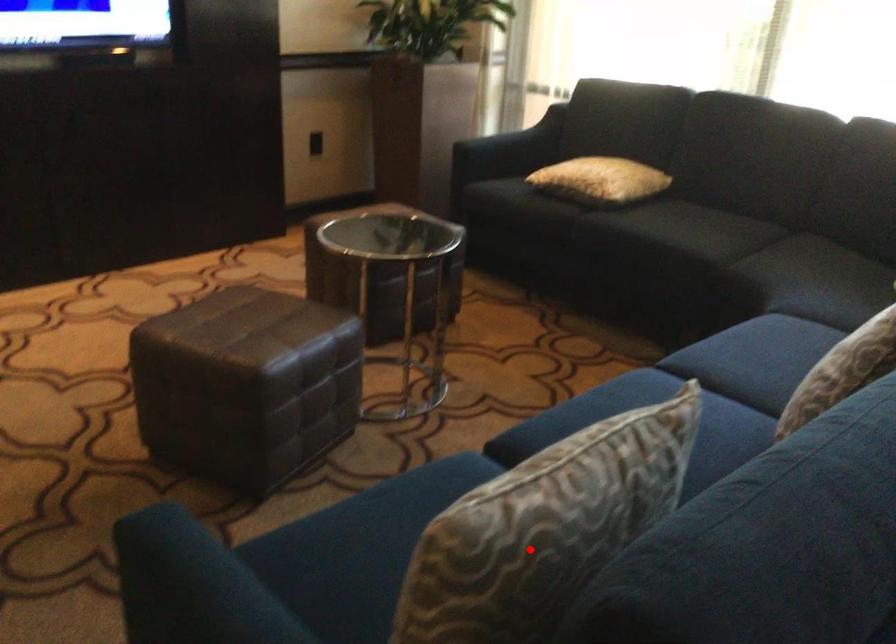
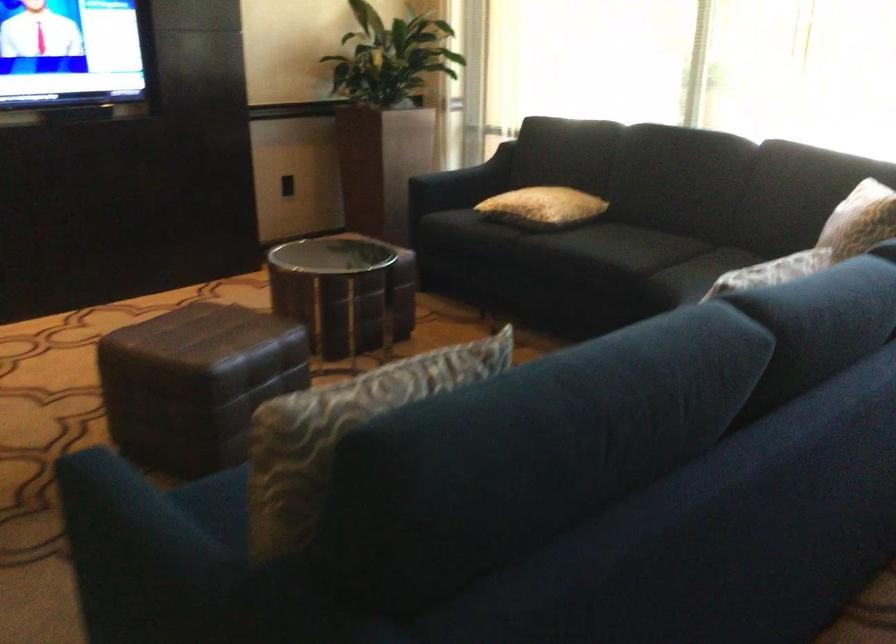
In the second image, find the point that corresponds to the highlighted location in the first image.

(340, 431)